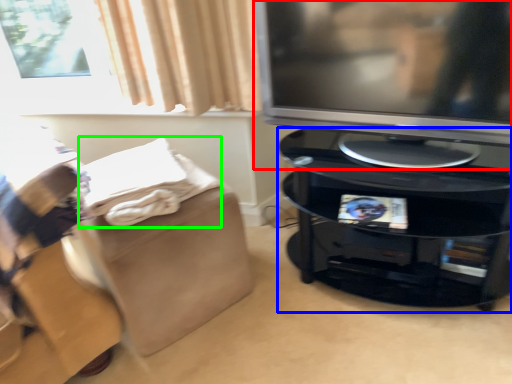
Question: Considering the real-world distances, which object is farthest from television (highlighted by a red box)? furniture (highlighted by a blue box) or blanket (highlighted by a green box)?

Choices:
 (A) furniture
 (B) blanket

Answer: (B)